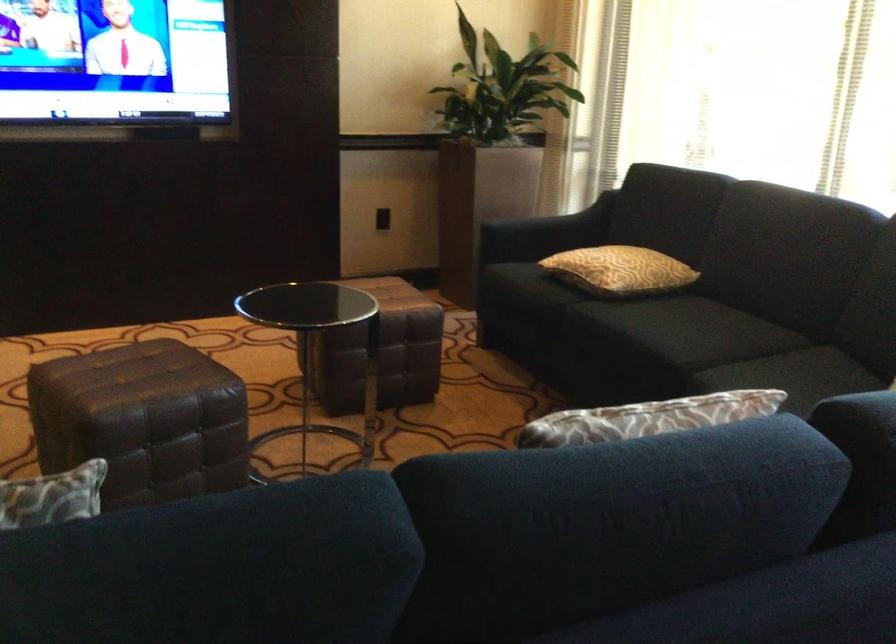
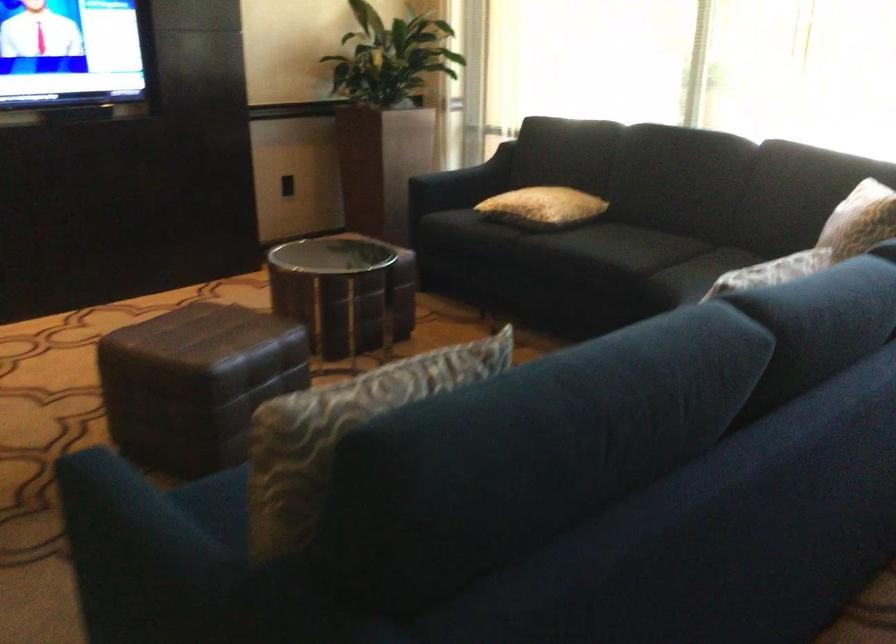
Find the pixel in the second image that matches pixel 607 269 in the first image.

(543, 207)